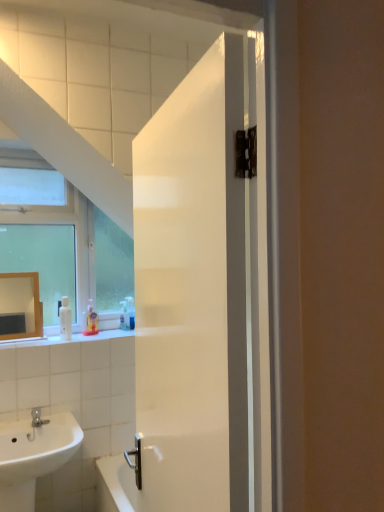
Question: Based on their sizes in the image, would you say white glossy soap dispenser at left is bigger or smaller than white glossy door at center?

Choices:
 (A) small
 (B) big

Answer: (A)

Question: Is white glossy soap dispenser at left wider or thinner than white glossy door at center?

Choices:
 (A) wide
 (B) thin

Answer: (B)

Question: Which object is positioned closest to the translucent plastic soap at lower left, placed as the 2th toiletry when sorted from left to right?

Choices:
 (A) white glossy soap dispenser at left
 (B) translucent plastic soap dispenser at lower left, the 2th toiletry when ordered from back to front
 (C) white glossy door at center
 (D) matte gold mirror at upper left
 (E) white glossy sink at lower left

Answer: (B)

Question: Considering the real-world distances, which object is closest to the translucent plastic soap dispenser at lower left, the 2th toiletry when ordered from back to front?

Choices:
 (A) white glossy soap dispenser at left
 (B) white glossy sink at lower left
 (C) translucent plastic soap at lower left, placed as the 2th toiletry when sorted from left to right
 (D) matte gold mirror at upper left
 (E) white glossy door at center

Answer: (A)